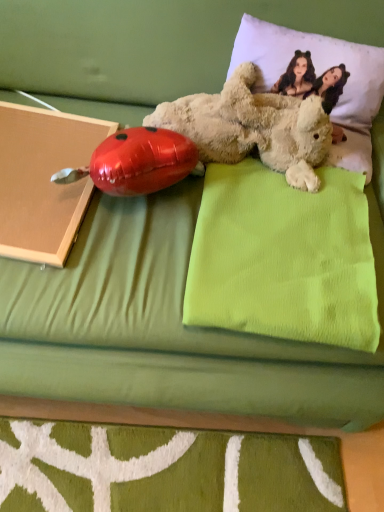
Question: Would you say matte cardboard book at left contains fluffy beige teddy bear at upper right?

Choices:
 (A) yes
 (B) no

Answer: (B)

Question: Can you confirm if matte cardboard book at left is smaller than fluffy beige teddy bear at upper right?

Choices:
 (A) no
 (B) yes

Answer: (B)

Question: Is there a large distance between matte cardboard book at left and fluffy beige teddy bear at upper right?

Choices:
 (A) yes
 (B) no

Answer: (B)

Question: Is matte cardboard book at left outside of fluffy beige teddy bear at upper right?

Choices:
 (A) yes
 (B) no

Answer: (A)

Question: Is matte cardboard book at left thinner than fluffy beige teddy bear at upper right?

Choices:
 (A) no
 (B) yes

Answer: (A)

Question: From a real-world perspective, is matte cardboard book at left over fluffy beige teddy bear at upper right?

Choices:
 (A) no
 (B) yes

Answer: (A)

Question: Could white soft pillow at upper right, which is counted as the second pillow, starting from the bottom, be considered to be inside matte cardboard book at left?

Choices:
 (A) no
 (B) yes

Answer: (A)

Question: From the image's perspective, is matte cardboard book at left over white soft pillow at upper right, the 1th pillow viewed from the top?

Choices:
 (A) yes
 (B) no

Answer: (B)

Question: Are matte cardboard book at left and white soft pillow at upper right, the 1th pillow viewed from the top, located far from each other?

Choices:
 (A) no
 (B) yes

Answer: (A)

Question: Is matte cardboard book at left outside white soft pillow at upper right, the 1th pillow viewed from the top?

Choices:
 (A) yes
 (B) no

Answer: (A)

Question: From the image's perspective, does matte cardboard book at left appear lower than white soft pillow at upper right, the 1th pillow viewed from the top?

Choices:
 (A) no
 (B) yes

Answer: (B)

Question: Does matte cardboard book at left have a smaller size compared to white soft pillow at upper right, which is counted as the second pillow, starting from the bottom?

Choices:
 (A) no
 (B) yes

Answer: (B)

Question: Does white soft pillow at upper right, which is counted as the second pillow, starting from the bottom, have a lesser width compared to fluffy beige teddy bear at upper right?

Choices:
 (A) yes
 (B) no

Answer: (A)